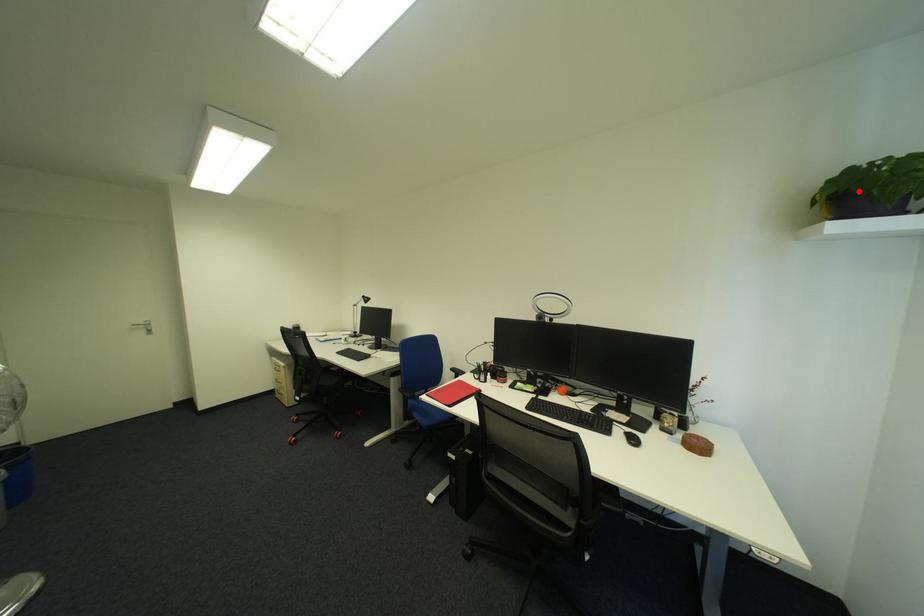
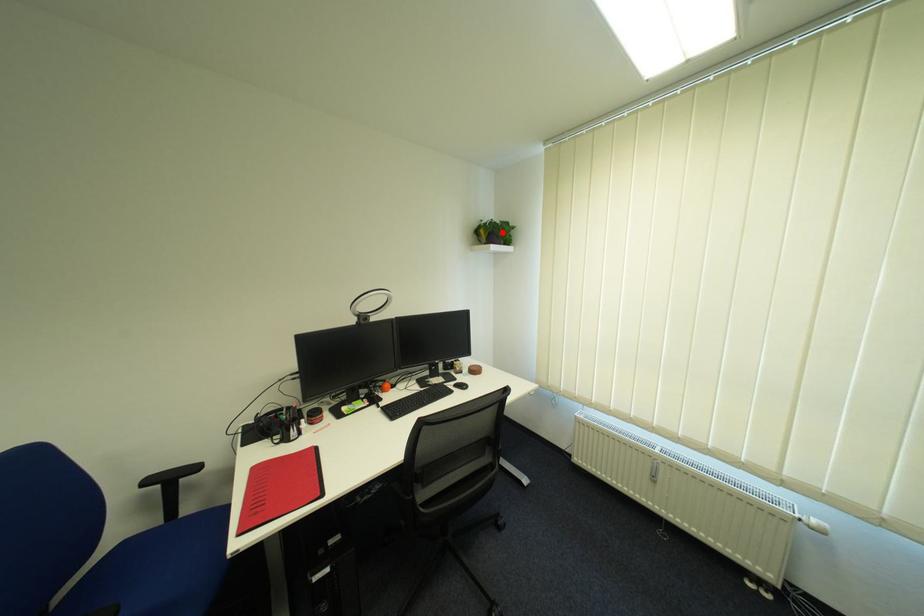
I am providing you with two images of the same scene from different viewpoints. A red point is marked on the first image and another point is marked on the second image. Do the highlighted points in image1 and image2 indicate the same real-world spot?

Yes